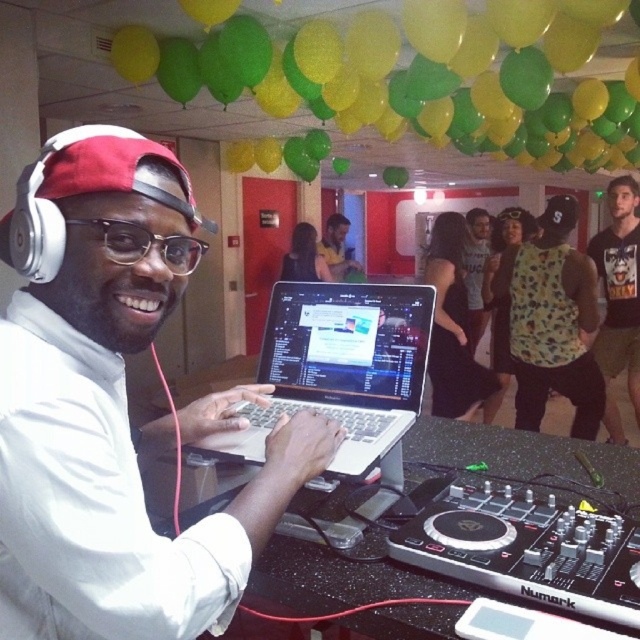
Is point (188, 419) more distant than point (268, 77)?

No, it is not.

Does white matte headphones at upper left appear on the left side of green matte balloon at upper center?

Yes, white matte headphones at upper left is to the left of green matte balloon at upper center.

Is point (163, 598) farther from viewer compared to point (124, 42)?

No, it is not.

Locate an element on the screen. white matte headphones at upper left is located at coordinates (112, 406).

Can you confirm if green matte balloon at upper center is bigger than floral-patterned tank top at center?

Yes.

From the picture: Is green matte balloon at upper center closer to camera compared to floral-patterned tank top at center?

Yes, it is.

Based on the photo, measure the distance between point (506, 148) and camera.

Point (506, 148) and camera are 5.65 meters apart.

Where is `green matte balloon at upper center`? green matte balloon at upper center is located at coordinates (417, 74).

Who is taller, dark gray t-shirt at center or black plastic glasses at center?

dark gray t-shirt at center is taller.

Measure the distance between dark gray t-shirt at center and black plastic glasses at center.

dark gray t-shirt at center and black plastic glasses at center are 3.52 meters apart from each other.

Does point (620, 440) come in front of point (141, 227)?

No, (620, 440) is further to viewer.

Where is `dark gray t-shirt at center`? The width and height of the screenshot is (640, 640). dark gray t-shirt at center is located at coordinates (618, 298).